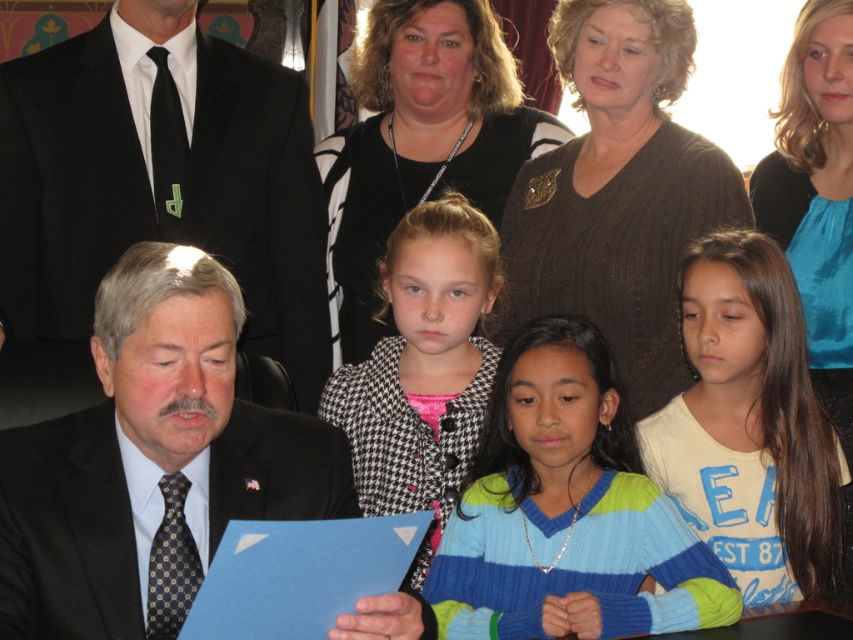
Question: Does striped sweater at center have a greater width compared to houndstooth coat at center?

Choices:
 (A) yes
 (B) no

Answer: (A)

Question: Which of these objects is positioned closest to the houndstooth coat at center?

Choices:
 (A) black suit at left
 (B) striped sweater at center
 (C) black suit at upper left
 (D) blue silk blouse at upper right

Answer: (B)

Question: Is black suit at left below houndstooth coat at center?

Choices:
 (A) no
 (B) yes

Answer: (B)

Question: Which object is the closest to the houndstooth coat at center?

Choices:
 (A) black suit at upper left
 (B) striped sweater at center

Answer: (B)

Question: Which point is farther from the camera taking this photo?

Choices:
 (A) (80, 124)
 (B) (373, 132)
 (C) (682, 608)

Answer: (B)

Question: Can you confirm if black suit at left is positioned above black and white sweater at upper center?

Choices:
 (A) no
 (B) yes

Answer: (A)